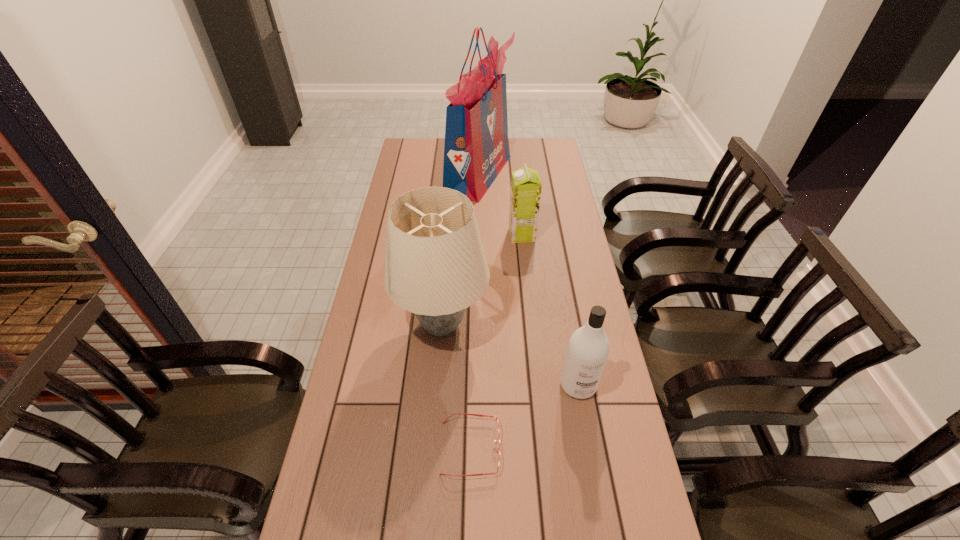
This screenshot has width=960, height=540. What are the coordinates of `the farthest object` in the screenshot? It's located at (476, 149).

I want to click on grocery bag, so click(476, 149).

Find the location of a particular element. the second tallest object is located at coordinates (435, 266).

Find the location of a particular element. lampshade is located at coordinates (435, 266).

The width and height of the screenshot is (960, 540). Identify the location of shampoo. (588, 348).

At what (x,y) coordinates should I click in order to perform the action: click on the rightmost object. Please return your answer as a coordinate pair (x, y). The image size is (960, 540). Looking at the image, I should click on (588, 348).

The height and width of the screenshot is (540, 960). Identify the location of soya milk. (526, 186).

The image size is (960, 540). In order to click on the nearest object in this screenshot , I will do `click(480, 415)`.

What are the coordinates of `spectacles` in the screenshot? It's located at (480, 415).

Locate an element on the screen. This screenshot has height=540, width=960. free location located on the front-facing side of the tallest object is located at coordinates (551, 174).